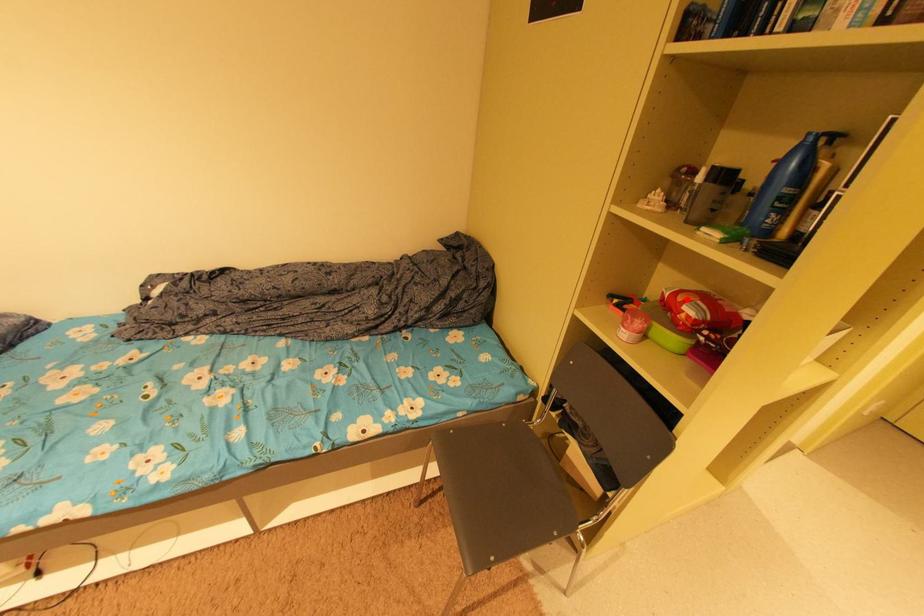
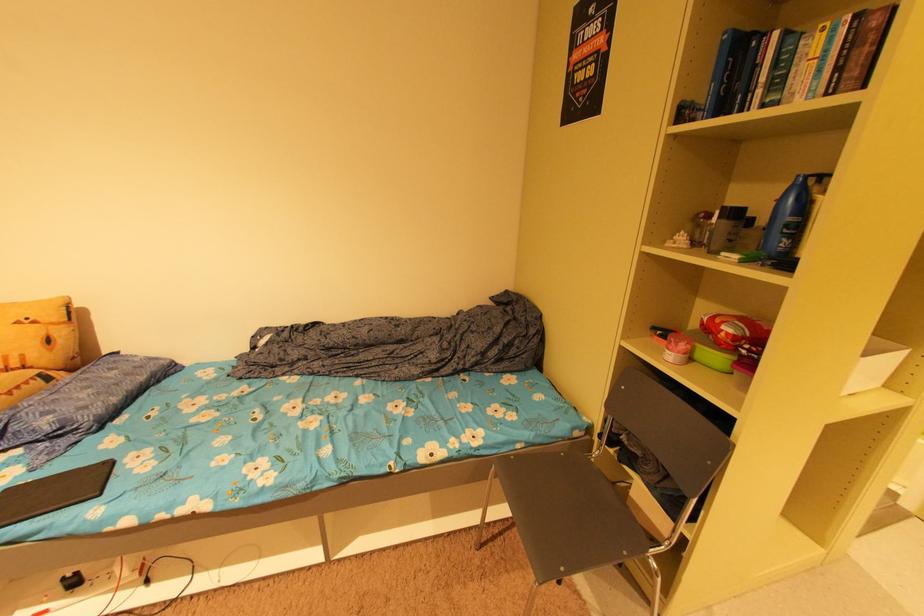
The point at the highlighted location is marked in the first image. Where is the corresponding point in the second image?

(724, 322)